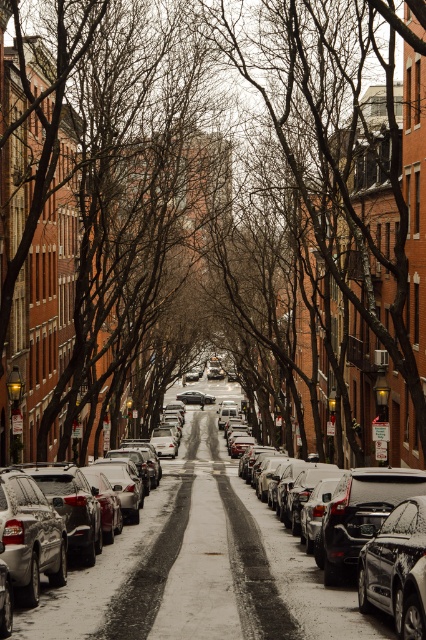
How much distance is there between brown leafless tree at center and shiny black sedan at center?

brown leafless tree at center and shiny black sedan at center are 37.28 meters apart.

Is point (236, 209) behind point (382, 588)?

Yes, it is.

Locate an element on the screen. brown leafless tree at center is located at coordinates (210, 218).

Between brown leafless tree at center and silver metallic sedan at center, which one has less height?

With less height is silver metallic sedan at center.

Which is in front, point (206, 104) or point (281, 561)?

Point (281, 561)

This screenshot has height=640, width=426. I want to click on brown leafless tree at center, so click(210, 218).

Is point (230, 476) positioned in front of point (411, 618)?

That is False.

Which is more to the left, silver metallic sedan at center or shiny black sedan at center?

From the viewer's perspective, silver metallic sedan at center appears more on the left side.

Does point (282, 572) lie in front of point (402, 550)?

That is False.

Find the location of a particular element. Image resolution: width=426 pixels, height=640 pixels. silver metallic sedan at center is located at coordinates (307, 579).